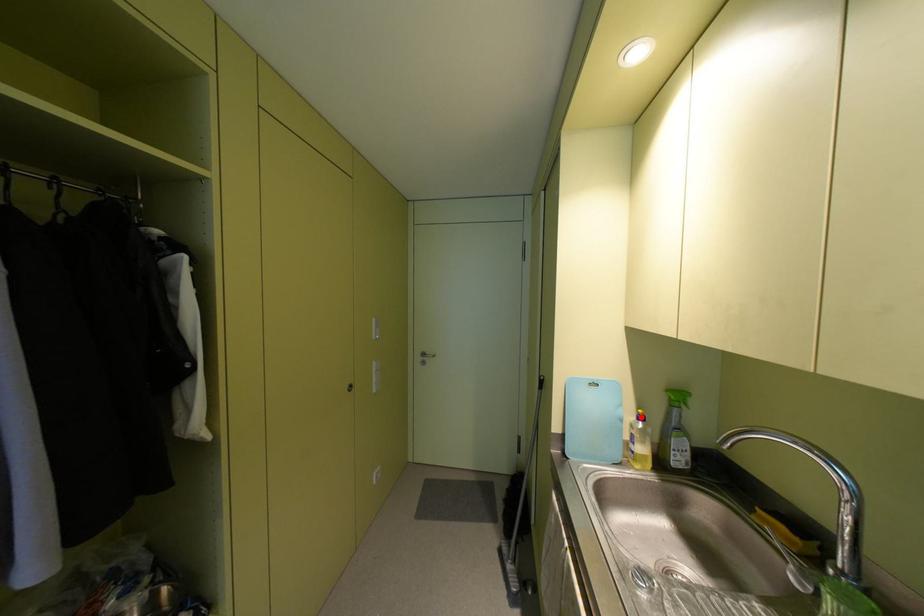
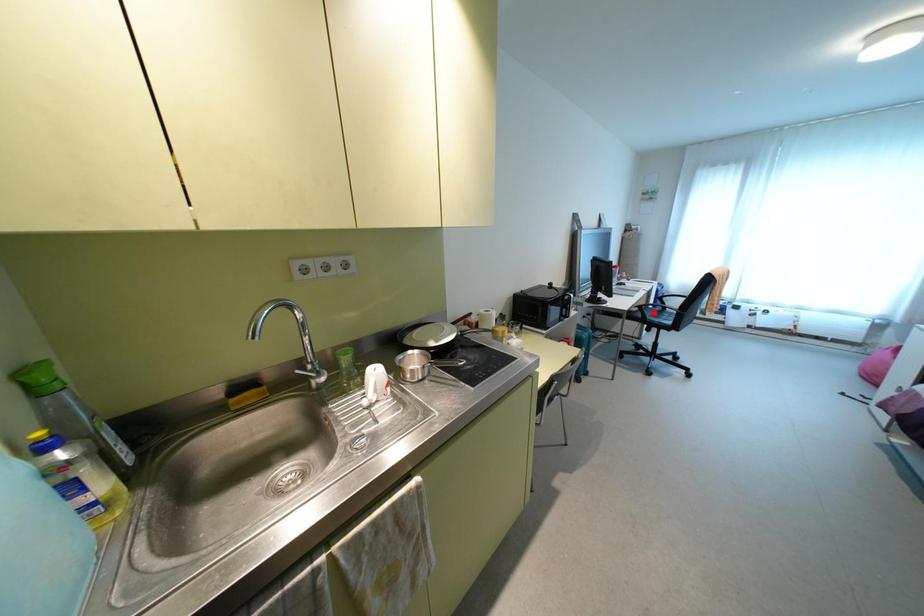
I am providing you with two images of the same scene from different viewpoints. A red point is marked on the first image and another point is marked on the second image. Do the highlighted points in image1 and image2 indicate the same real-world spot?

No